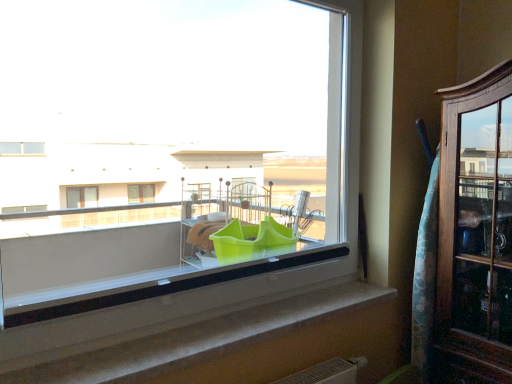
Find the location of a particular element. Image resolution: width=512 pixels, height=384 pixels. smooth concrete window sill at center is located at coordinates (230, 344).

What do you see at coordinates (168, 147) in the screenshot? I see `green plastic container at center` at bounding box center [168, 147].

I want to click on smooth concrete window sill at center, so click(x=230, y=344).

In terms of width, does green plastic container at center look wider or thinner when compared to wooden cabinet at right?

Clearly, green plastic container at center has less width compared to wooden cabinet at right.

Identify the location of window above the wooden cabinet at right (from a real-world perspective). The image size is (512, 384). 168,147.

Is green plastic container at center inside the boundaries of wooden cabinet at right, or outside?

green plastic container at center is not inside wooden cabinet at right, it's outside.

Considering the relative positions of green plastic container at center and wooden cabinet at right in the image provided, is green plastic container at center to the right of wooden cabinet at right from the viewer's perspective?

No, green plastic container at center is not to the right of wooden cabinet at right.

How far apart are wooden cabinet at right and green plastic container at center?

wooden cabinet at right is 2.06 meters away from green plastic container at center.

How different are the orientations of wooden cabinet at right and green plastic container at center in degrees?

The facing directions of wooden cabinet at right and green plastic container at center are 91.7 degrees apart.

Considering the sizes of objects wooden cabinet at right and green plastic container at center in the image provided, who is wider, wooden cabinet at right or green plastic container at center?

wooden cabinet at right.

Considering the sizes of wooden cabinet at right and green plastic container at center in the image, is wooden cabinet at right taller or shorter than green plastic container at center?

In the image, wooden cabinet at right appears to be taller than green plastic container at center.

Does smooth concrete window sill at center have a larger size compared to green plastic container at center?

No, smooth concrete window sill at center is not bigger than green plastic container at center.

Is smooth concrete window sill at center facing away from green plastic container at center?

No, green plastic container at center is not at the back of smooth concrete window sill at center.

What's the angular difference between smooth concrete window sill at center and green plastic container at center's facing directions?

The angular difference between smooth concrete window sill at center and green plastic container at center is 0.684 degrees.

Is wooden cabinet at right far from smooth concrete window sill at center?

Actually, wooden cabinet at right and smooth concrete window sill at center are a little close together.

Is wooden cabinet at right completely or partially outside of smooth concrete window sill at center?

Yes, wooden cabinet at right is not within smooth concrete window sill at center.

Is point (461, 117) positioned after point (288, 315)?

Yes.

Is wooden cabinet at right closer to camera compared to smooth concrete window sill at center?

That is False.

Does point (140, 212) appear closer or farther from the camera than point (202, 374)?

Point (140, 212).

Between green plastic container at center and smooth concrete window sill at center, which one has larger size?

With larger size is green plastic container at center.

Locate an element on the screen. window sill on the right side of green plastic container at center is located at coordinates (230, 344).

How different are the orientations of green plastic container at center and smooth concrete window sill at center in degrees?

0.684 degrees.

Are smooth concrete window sill at center and wooden cabinet at right beside each other?

No, smooth concrete window sill at center is not next to wooden cabinet at right.

From the image's perspective, is smooth concrete window sill at center above or below wooden cabinet at right?

Based on their image positions, smooth concrete window sill at center is located beneath wooden cabinet at right.

Which is correct: smooth concrete window sill at center is inside wooden cabinet at right, or outside of it?

smooth concrete window sill at center is not enclosed by wooden cabinet at right.

The image size is (512, 384). What are the coordinates of `window above the wooden cabinet at right (from a real-world perspective)` in the screenshot? It's located at (168, 147).

What are the coordinates of `window in front of the wooden cabinet at right` in the screenshot? It's located at (168, 147).

Looking at the image, which one is located further to green plastic container at center, wooden cabinet at right or smooth concrete window sill at center?

smooth concrete window sill at center.

Estimate the real-world distances between objects in this image. Which object is closer to green plastic container at center, smooth concrete window sill at center or wooden cabinet at right?

wooden cabinet at right is closer to green plastic container at center.

From the picture: Which object lies nearer to the anchor point wooden cabinet at right, green plastic container at center or smooth concrete window sill at center?

Based on the image, smooth concrete window sill at center appears to be nearer to wooden cabinet at right.

Which object lies further to the anchor point smooth concrete window sill at center, wooden cabinet at right or green plastic container at center?

green plastic container at center lies further to smooth concrete window sill at center than the other object.

Considering their positions, is green plastic container at center positioned further to smooth concrete window sill at center than wooden cabinet at right?

green plastic container at center.

Based on their spatial positions, is smooth concrete window sill at center or green plastic container at center further from wooden cabinet at right?

The object further to wooden cabinet at right is green plastic container at center.

You are a GUI agent. You are given a task and a screenshot of the screen. Output one action in this format:
    pyautogui.click(x=<x>, y=<y>)
    Task: Click on the window sill situated between green plastic container at center and wooden cabinet at right from left to right
    The width and height of the screenshot is (512, 384).
    Given the screenshot: What is the action you would take?
    pyautogui.click(x=230, y=344)